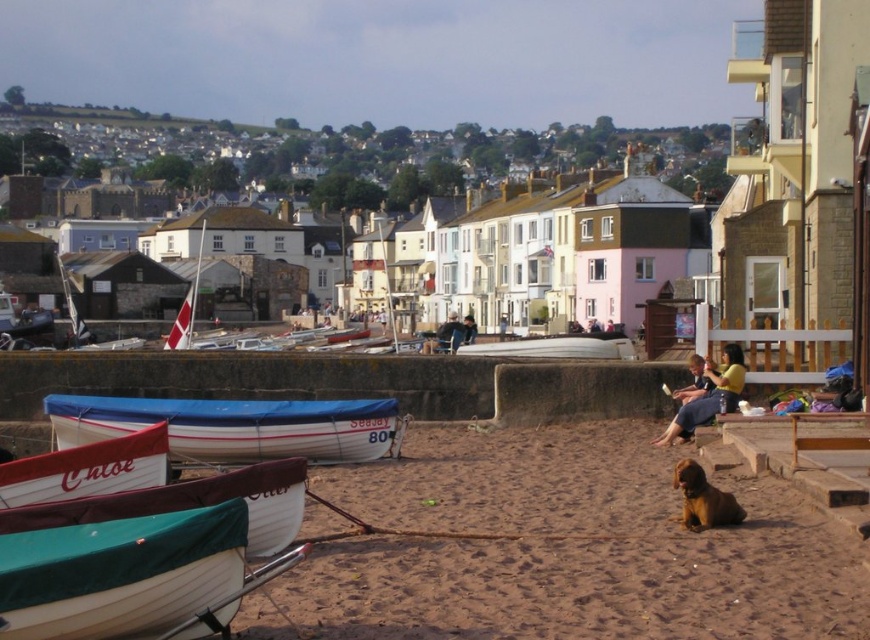
You are standing on the beach and want to take a photo of both the point at coordinates point (526, 348) and the point at coordinates point (688, 388). Which point should you focus on first to ensure both are in sharp focus?

You should focus on the point at coordinates point (526, 348) first because it is closer to you than the point at coordinates point (688, 388), which is further away. This ensures both points will be in focus when using depth of field appropriately.

You are standing on the beach and want to reach the white striped tarpaulin boat at lower left. The distance you can walk is limited to 200 feet due to low tide. Can you safely reach the boat without getting your shoes wet?

The white striped tarpaulin boat at lower left is 217.14 feet away from viewer. Since the maximum walking distance is 200 feet, you cannot safely reach the boat without getting your shoes wet.